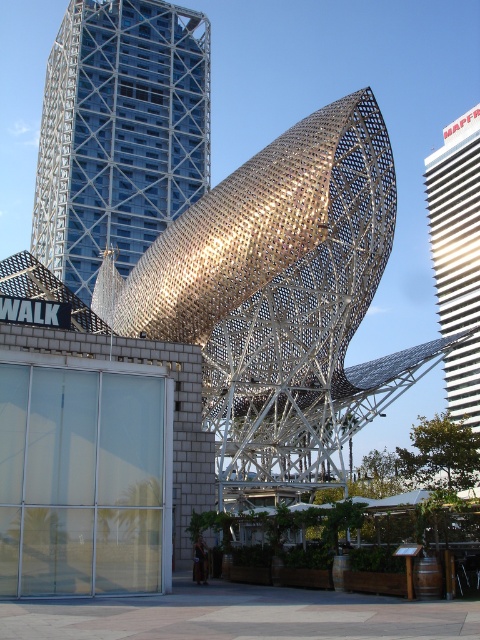
Does blue glassy tower at upper left appear over white glossy tower at right?

Yes, blue glassy tower at upper left is above white glossy tower at right.

How far apart are blue glassy tower at upper left and white glossy tower at right?

They are 61.63 meters apart.

Is point (146, 83) positioned behind point (440, 305)?

No, (146, 83) is closer to viewer.

The height and width of the screenshot is (640, 480). I want to click on blue glassy tower at upper left, so click(120, 132).